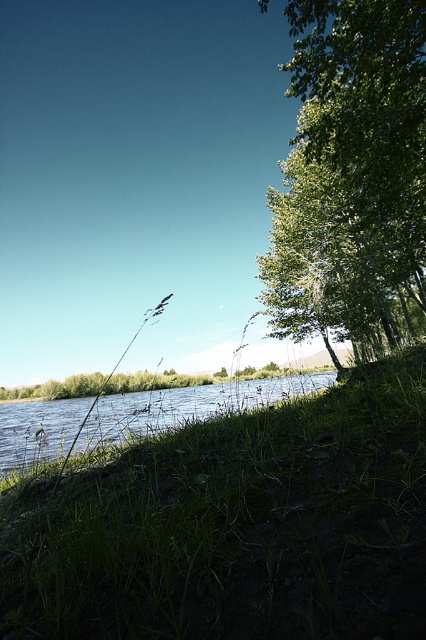
Based on the scene description, what are the coordinates of the green leafy tree at right?

The green leafy tree at right is located at coordinates point [351,177].

You are standing at the center of the scene and want to take a photo that includes both the green leafy tree at right and the green grassy river at lower left. Which object should you adjust your camera angle to focus on first to ensure both are in frame?

The green leafy tree at right is much taller than the green grassy river at lower left, so you should focus on including the tree first in your camera angle to ensure both are visible.

You are standing at the center of the scene and want to take a photo. There are two points marked in the image, point (307, 250) and point (0, 424). Which point should you focus on first if you want to capture the closest object in your shot?

Point (307, 250) should be focused on first because it is closer to the camera than point (0, 424), making it the nearest object in the scene.